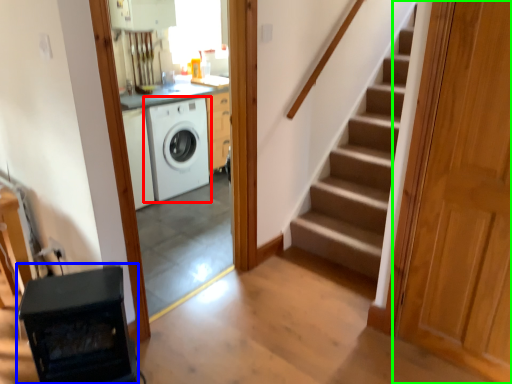
Question: Which object is positioned closest to washing machine (highlighted by a red box)? Select from appliance (highlighted by a blue box) and door (highlighted by a green box).

Choices:
 (A) appliance
 (B) door

Answer: (A)